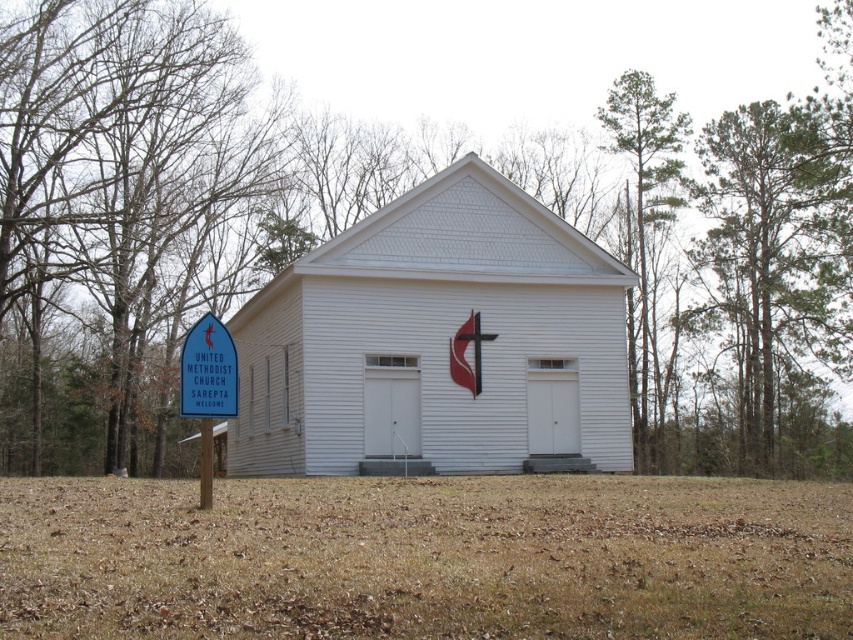
Which of these two, white wooden church at center or blue plastic sign at left, stands shorter?

blue plastic sign at left

At what (x,y) coordinates should I click in order to perform the action: click on white wooden church at center. Please return your answer as a coordinate pair (x, y). Looking at the image, I should click on (437, 342).